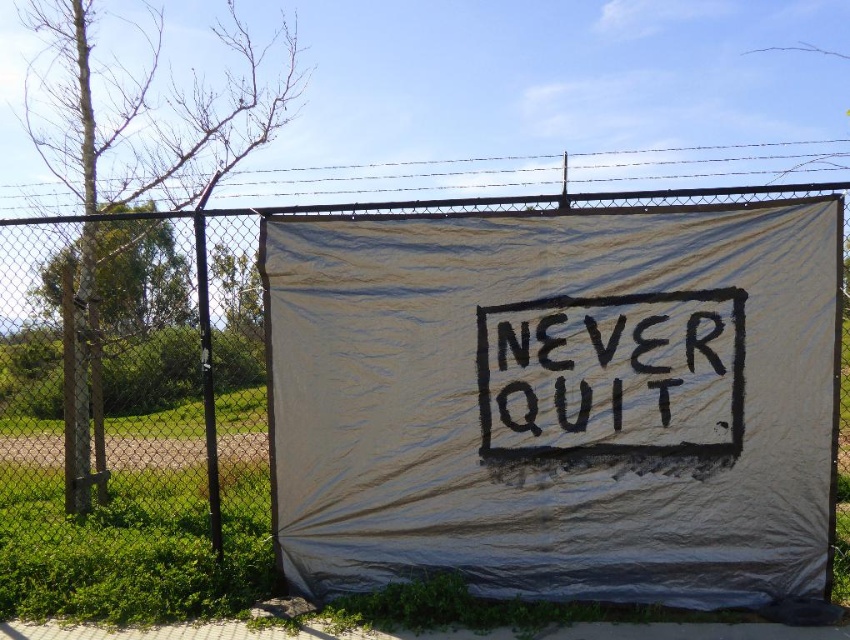
Is white fabric banner at center shorter than black chalkboard at center?

Yes, white fabric banner at center is shorter than black chalkboard at center.

Is white fabric banner at center positioned in front of black chalkboard at center?

No, it is not.

Image resolution: width=850 pixels, height=640 pixels. What are the coordinates of `white fabric banner at center` in the screenshot? It's located at (265, 328).